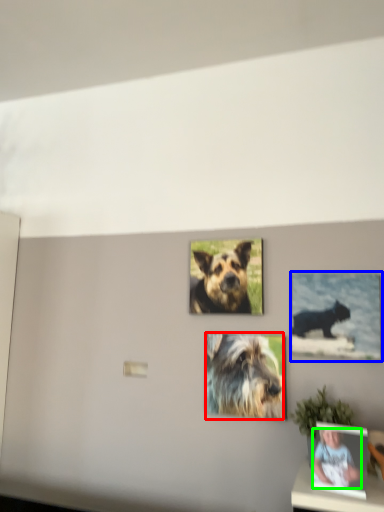
Question: Estimate the real-world distances between objects in this image. Which object is closer to dog (highlighted by a red box), picture frame (highlighted by a blue box) or person (highlighted by a green box)?

Choices:
 (A) picture frame
 (B) person

Answer: (A)